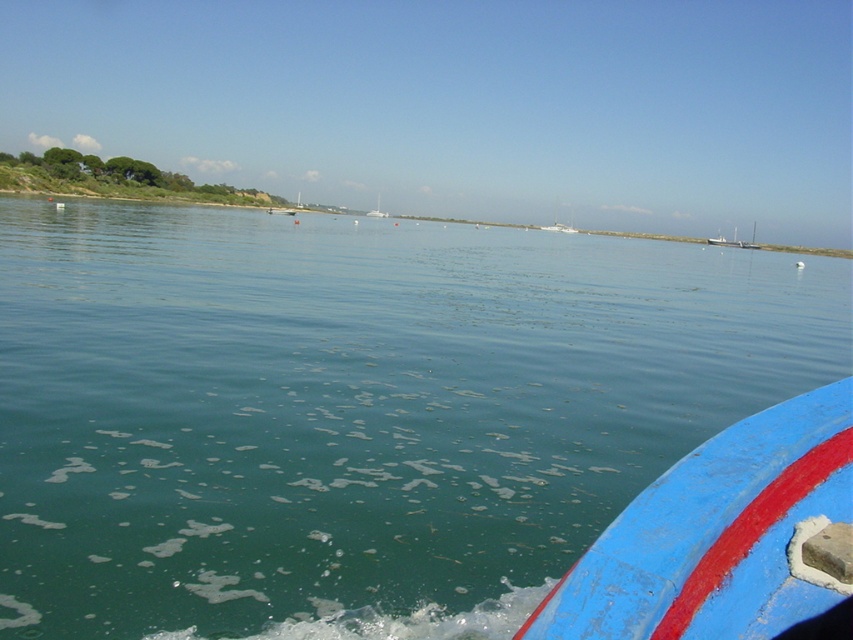
Is green matte water at center positioned behind white glossy sailboat at center?

No, it is not.

Who is lower down, green matte water at center or white glossy sailboat at center?

green matte water at center

What do you see at coordinates (355, 410) in the screenshot? The height and width of the screenshot is (640, 853). I see `green matte water at center` at bounding box center [355, 410].

Locate an element on the screen. green matte water at center is located at coordinates (355, 410).

How distant is green matte water at center from blue painted wood boat at lower right?

17.64 meters

Is green matte water at center smaller than blue painted wood boat at lower right?

No.

Find the location of a particular element. This screenshot has width=853, height=640. green matte water at center is located at coordinates (355, 410).

Can you confirm if white plastic boat at center is positioned below white glossy sailboat at center?

Correct, white plastic boat at center is located below white glossy sailboat at center.

Is white plastic boat at center bigger than white glossy sailboat at center?

Yes.

In order to click on white plastic boat at center in this screenshot , I will do `click(733, 241)`.

The width and height of the screenshot is (853, 640). I want to click on white plastic boat at center, so click(x=733, y=241).